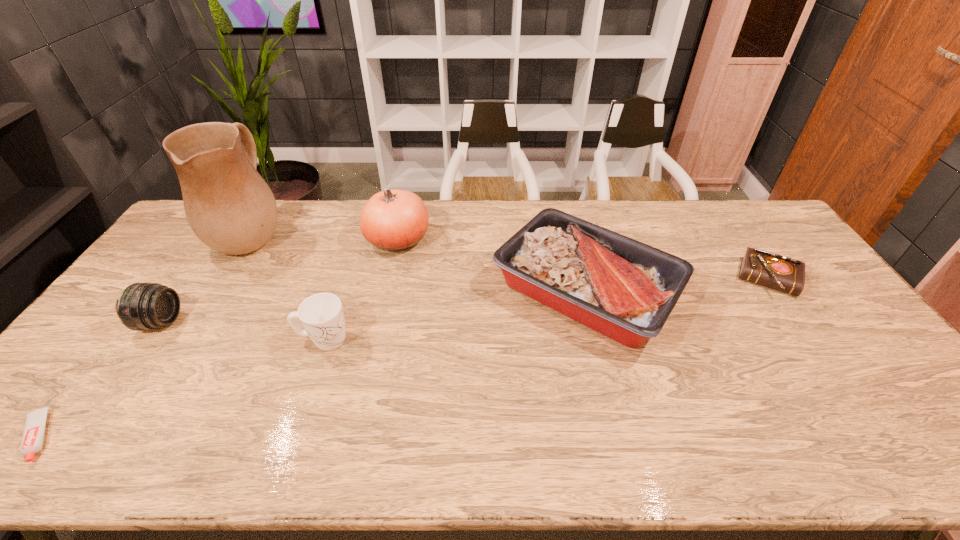
Where is `blank space at the far edge`? This screenshot has width=960, height=540. blank space at the far edge is located at coordinates (449, 207).

In the image, there is a desktop. In order to click on free space at the near edge in this screenshot , I will do `click(278, 461)`.

The width and height of the screenshot is (960, 540). I want to click on free space at the right edge, so 779,240.

The width and height of the screenshot is (960, 540). I want to click on vacant space at the near left corner of the desktop, so click(x=49, y=456).

Where is `empty space between the tray and the tallest object`? Image resolution: width=960 pixels, height=540 pixels. empty space between the tray and the tallest object is located at coordinates (420, 262).

Identify the location of free space that is in between the telephoto lens and the cream pitcher. (206, 278).

You are a GUI agent. You are given a task and a screenshot of the screen. Output one action in this format:
    pyautogui.click(x=<x>, y=<y>)
    Task: Click on the vacant space in between the telephoto lens and the second object from right to left
    This screenshot has height=540, width=960.
    Given the screenshot: What is the action you would take?
    pyautogui.click(x=373, y=306)

The image size is (960, 540). Find the location of `free spot between the cream pitcher and the sixth shortest object`. free spot between the cream pitcher and the sixth shortest object is located at coordinates (324, 237).

Identify the location of free area in between the telephoto lens and the second shortest object. Image resolution: width=960 pixels, height=540 pixels. tap(465, 300).

At what (x,y) coordinates should I click in order to perform the action: click on free space that is in between the sixth shortest object and the telephoto lens. Please return your answer as a coordinate pair (x, y). Looking at the image, I should click on (279, 281).